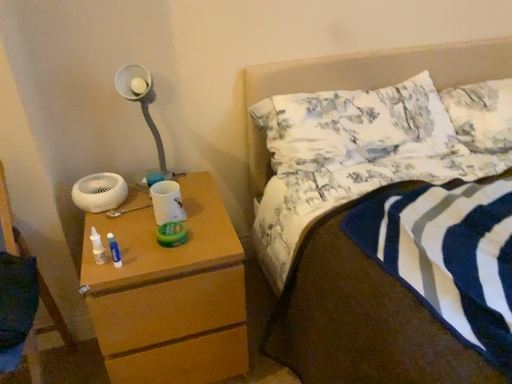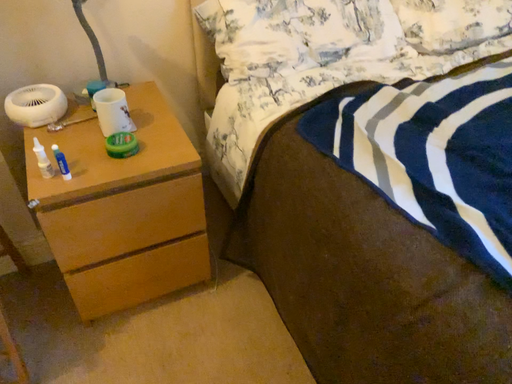
Question: Which way did the camera rotate in the video?

Choices:
 (A) rotated downward
 (B) rotated upward

Answer: (A)